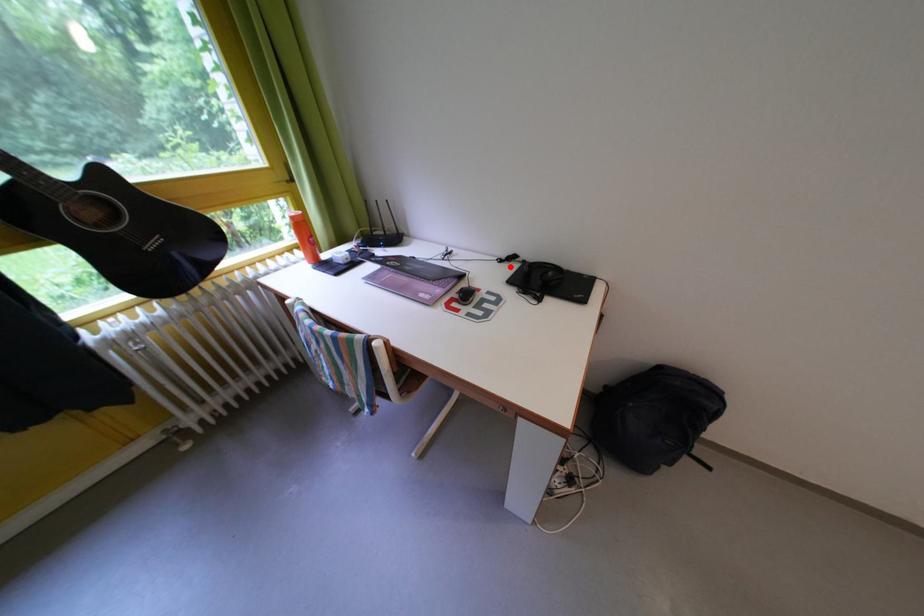
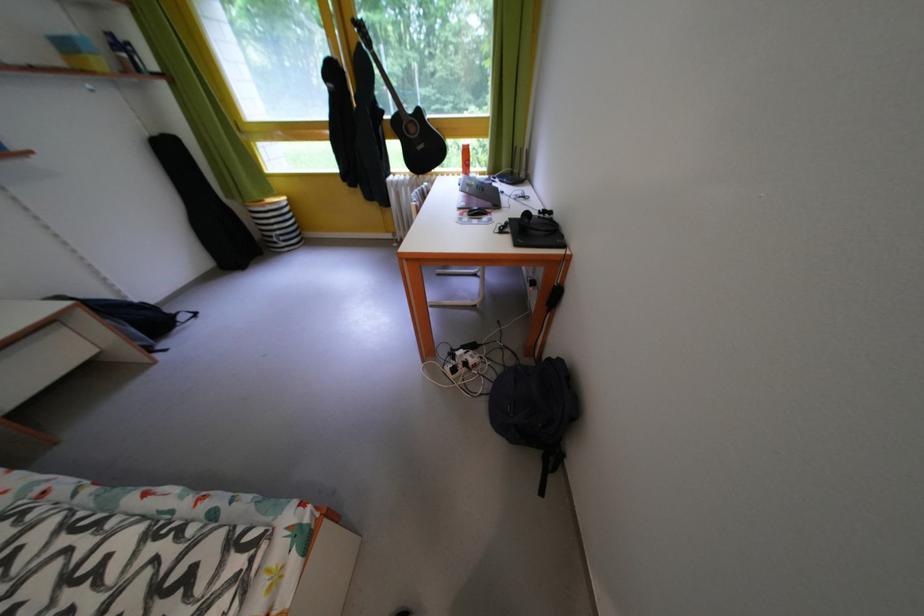
Where in the second image is the point corresponding to the highlighted location from the first image?

(550, 217)